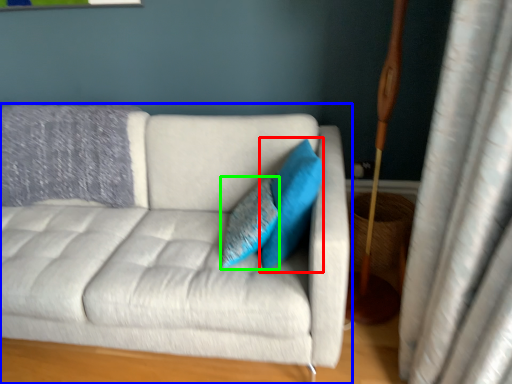
Question: Considering the real-world distances, which object is farthest from pillow (highlighted by a red box)? studio couch (highlighted by a blue box) or pillow (highlighted by a green box)?

Choices:
 (A) studio couch
 (B) pillow

Answer: (A)